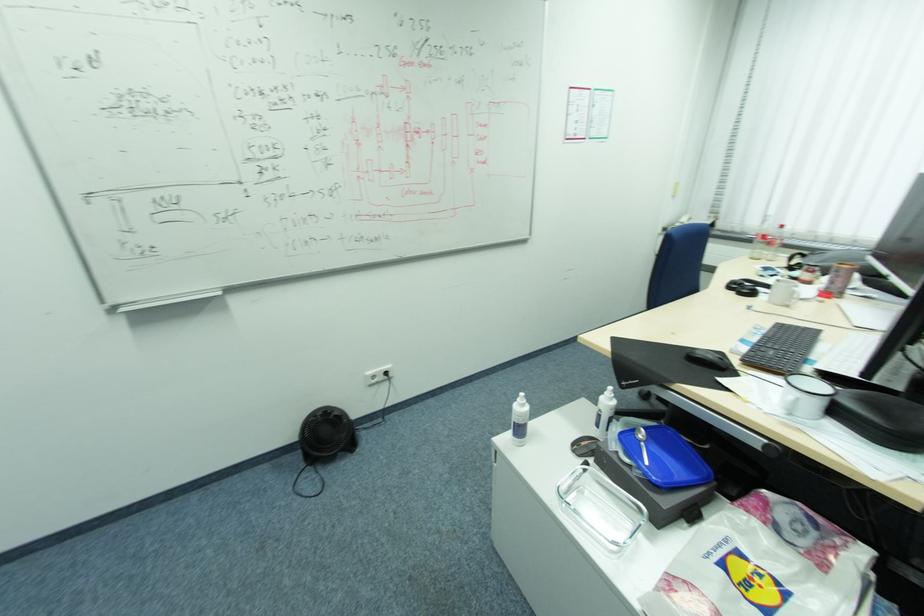
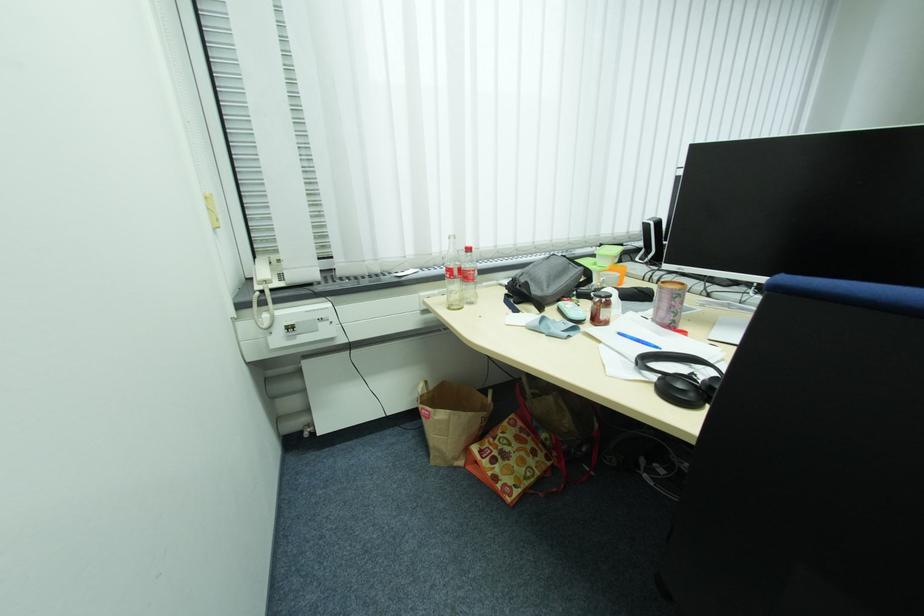
Where in the second image is the point corresponding to the point at 843,268 from the first image?

(687, 290)